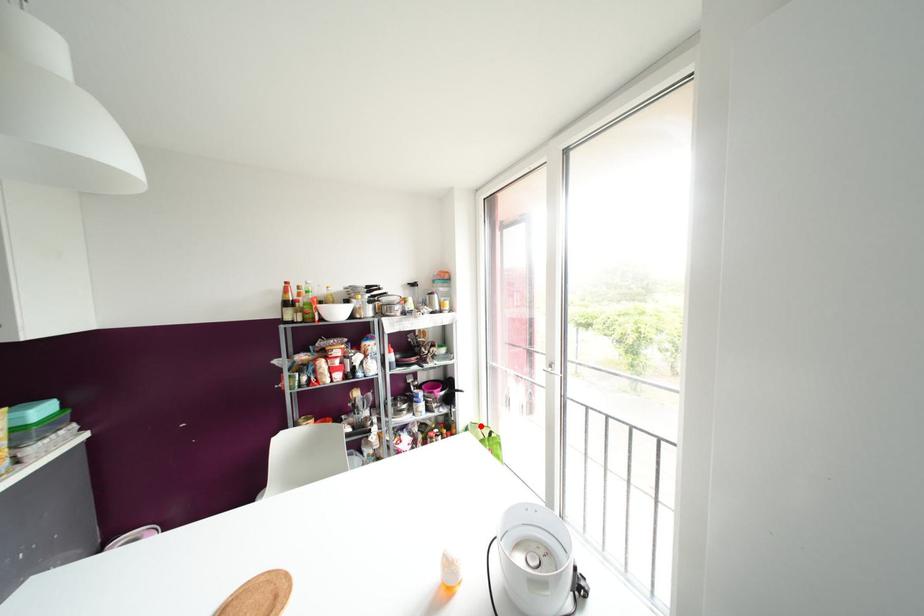
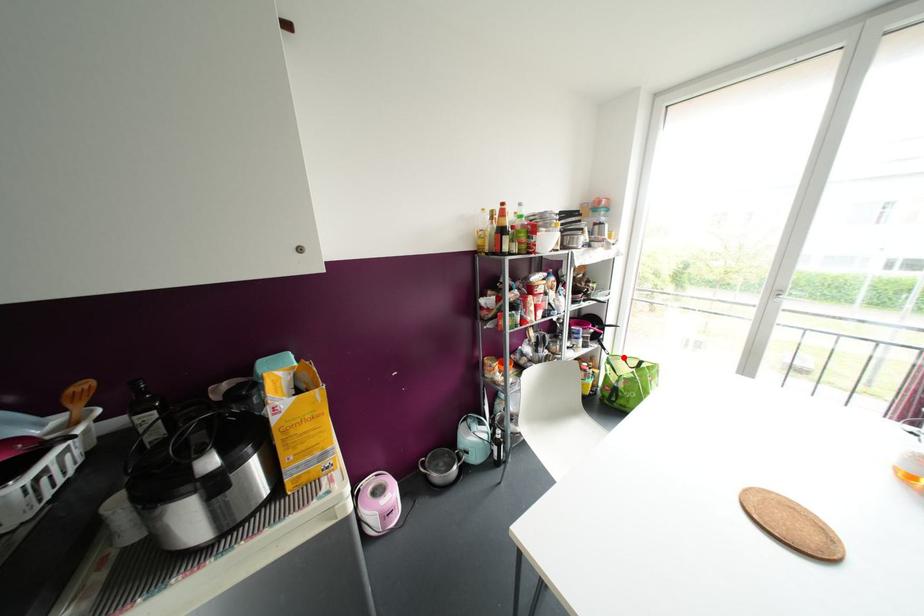
I am providing you with two images of the same scene from different viewpoints. A red point is marked on the first image and another point is marked on the second image. Are the points marked in image1 and image2 representing the same 3D position?

Yes